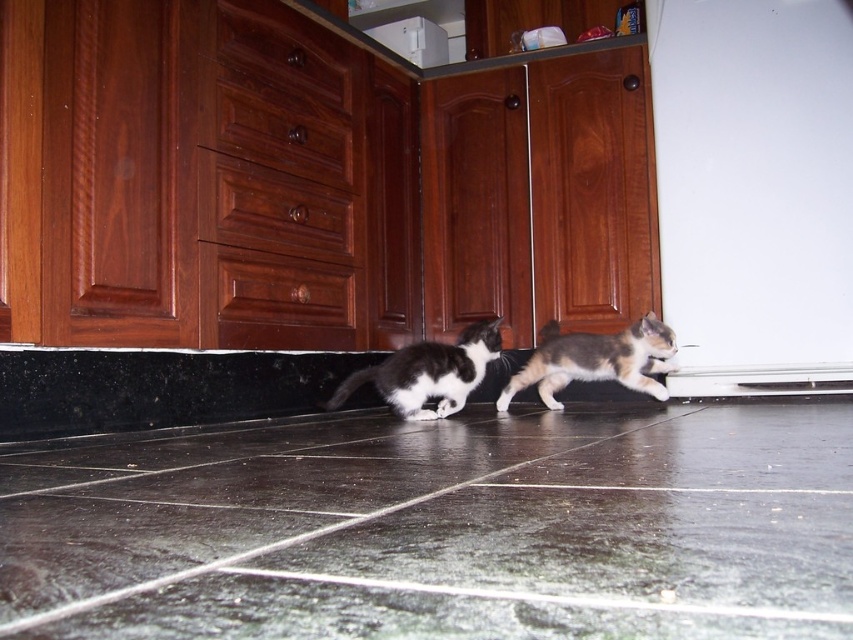
You are a photographer trying to capture a clear shot of the calico fur cat at center. Since the black tile floor at lower center is in the way, can you move the cat to a different spot where it won

The black tile floor at lower center is larger in size than calico fur cat at center, so there is enough space to move the cat to another area on the floor without needing to move the floor itself.

You are a photographer trying to capture both the calico fur cat at center and the black and white fur cat at center in a single shot. Given that your camera can only focus on objects within a 1.2 meter width, will both cats fit in the frame?

The calico fur cat at center is wider than the black and white fur cat at center. However, without knowing the total combined width of both cats, it is impossible to determine if they will fit within the 1.2 meter width constraint.

You are holding a 12 inch ruler and want to measure the distance between the point at coordinates point (585, 628) and yourself. Can you reach it with your ruler?

The distance between point (585, 628) and the viewer is 15.07 inches. Since the ruler is only 12 inches long, it is not long enough to measure the distance.